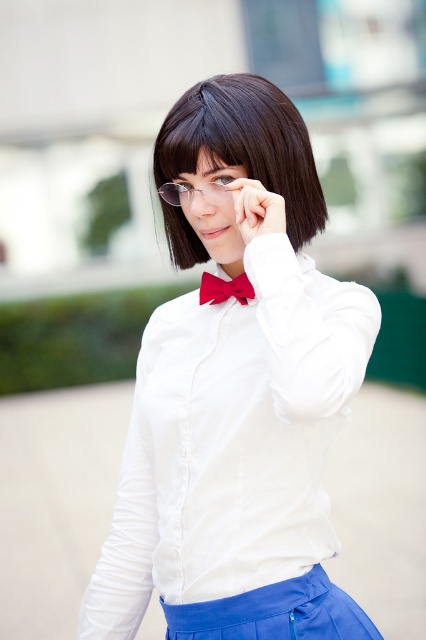
Question: Among these points, which one is nearest to the camera?

Choices:
 (A) (152, 168)
 (B) (203, 301)
 (C) (239, 172)

Answer: (C)

Question: Does white satin blouse at center come behind black silky hair at upper center?

Choices:
 (A) no
 (B) yes

Answer: (A)

Question: Considering the relative positions of white satin blouse at center and dark brown silky hair at center in the image provided, where is white satin blouse at center located with respect to dark brown silky hair at center?

Choices:
 (A) below
 (B) above

Answer: (A)

Question: Does matte white hand at center appear over black silky hair at upper center?

Choices:
 (A) no
 (B) yes

Answer: (A)

Question: Which point is farther to the camera?

Choices:
 (A) white satin blouse at center
 (B) matte white hand at center
 (C) dark brown silky hair at center

Answer: (C)

Question: Estimate the real-world distances between objects in this image. Which object is closer to the dark brown silky hair at center?

Choices:
 (A) matte white hand at center
 (B) black silky hair at upper center

Answer: (B)